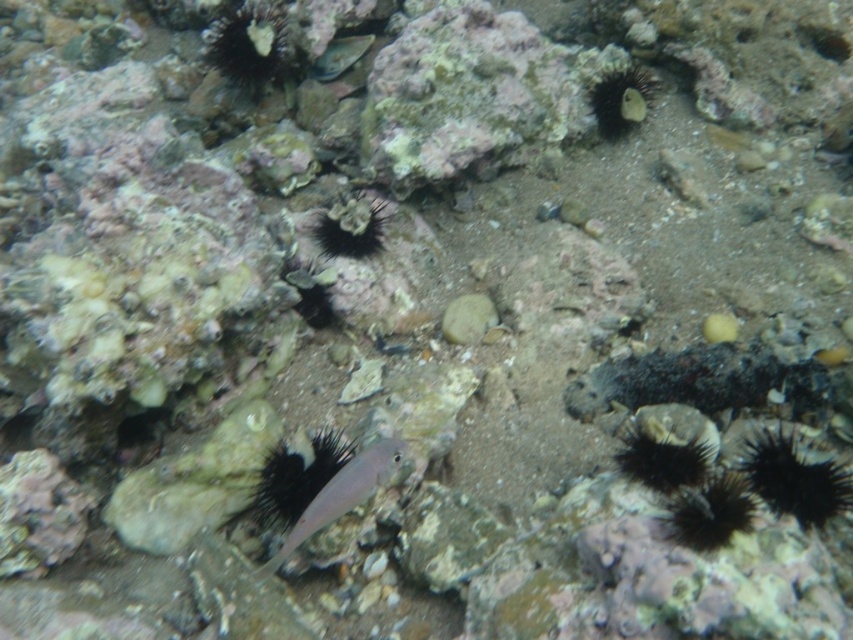
Looking at this image, you are a diver exploring the underwater scene. You notice two points marked in the image. Which point is closer to you, point (604, 76) or point (361, 44)?

Point (604, 76) is closer to the viewer than point (361, 44).

Based on the photo, you are a marine biologist examining an underwater scene. You need to determine the relative positions of the black spiny coral at center and the smooth black sea urchin at upper right. Which object is located to the left of the other?

The black spiny coral at center is positioned on the left side of smooth black sea urchin at upper right, so the black spiny coral at center is to the left of the smooth black sea urchin at upper right.